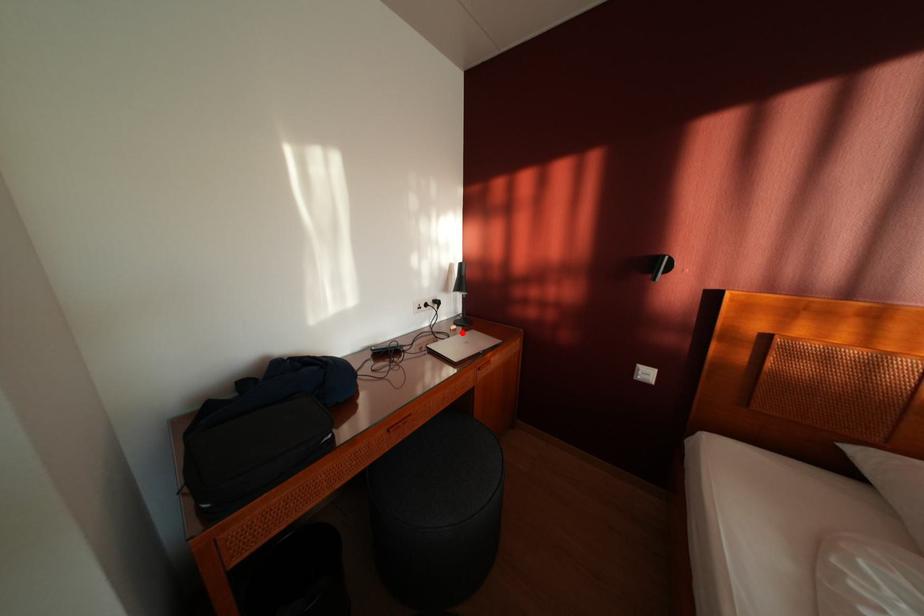
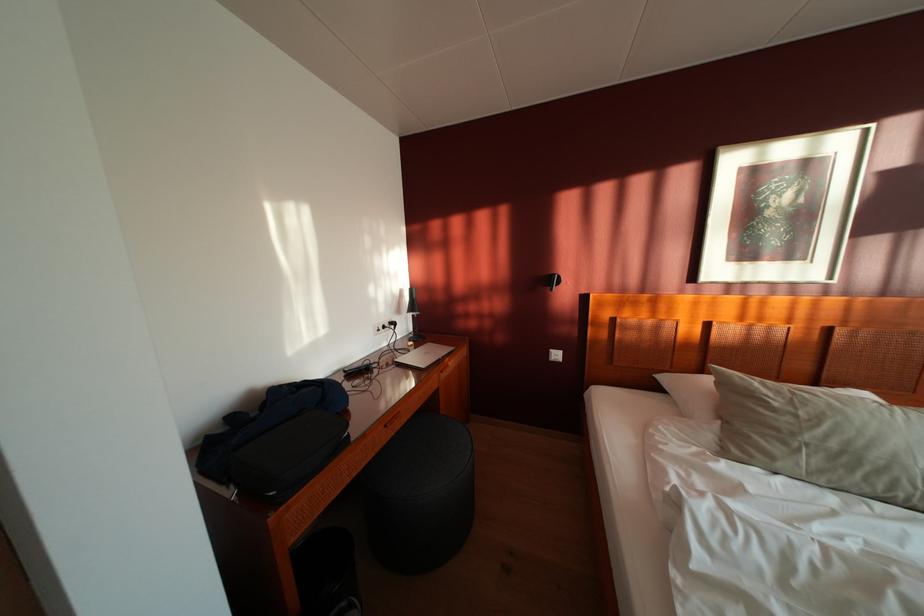
In the second image, find the point that corresponds to the highlighted location in the first image.

(419, 349)